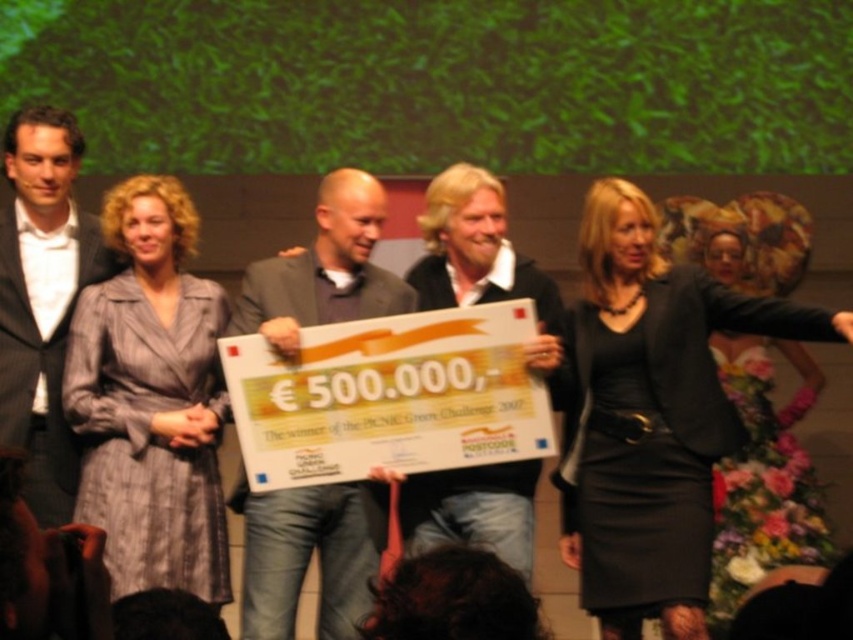
Question: Does black matte dress at center appear under gray striped dress at center?

Choices:
 (A) yes
 (B) no

Answer: (A)

Question: Is gray striped dress at center below matte black jacket at center?

Choices:
 (A) yes
 (B) no

Answer: (A)

Question: Which point is closer to the camera taking this photo?

Choices:
 (A) (323, 568)
 (B) (67, 435)

Answer: (A)

Question: Based on their relative distances, which object is nearer to the gray striped dress at center?

Choices:
 (A) matte black suit at left
 (B) matte black jacket at center
 (C) matte gray suit at center

Answer: (A)

Question: Which of these objects is positioned closest to the matte black jacket at center?

Choices:
 (A) black matte dress at center
 (B) matte gray suit at center
 (C) gray striped dress at center
 (D) matte black suit at left

Answer: (B)

Question: Is matte gray suit at center thinner than matte black suit at left?

Choices:
 (A) no
 (B) yes

Answer: (A)